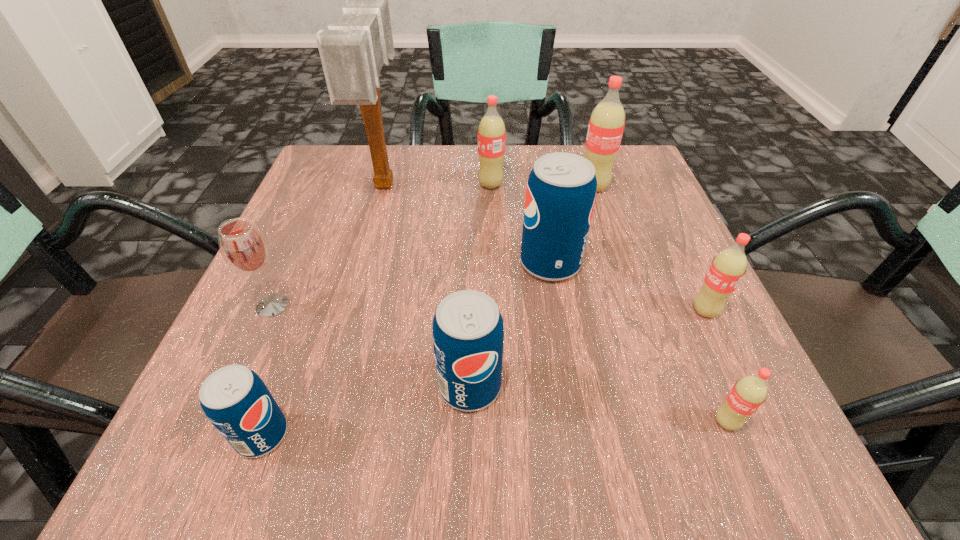
Locate which soda is the closest to the second biggest red soda. Please provide its 2D coordinates. Your answer should be formatted as a tuple, i.e. [(x, y)], where the tuple contains the x and y coordinates of a point satisfying the conditions above.

[(606, 125)]

Choose which red soda is the nearest neighbor to the fourth farthest object. Please provide its 2D coordinates. Your answer should be formatted as a tuple, i.e. [(x, y)], where the tuple contains the x and y coordinates of a point satisfying the conditions above.

[(606, 125)]

The width and height of the screenshot is (960, 540). I want to click on red soda that is the nearest to the second smallest blue pop, so click(x=750, y=392).

Locate which blue pop ranks second in proximity to the biggest blue pop. Please provide its 2D coordinates. Your answer should be formatted as a tuple, i.e. [(x, y)], where the tuple contains the x and y coordinates of a point satisfying the conditions above.

[(235, 400)]

Point out which blue pop is positioned as the third nearest to the seventh object from right to left. Please provide its 2D coordinates. Your answer should be formatted as a tuple, i.e. [(x, y)], where the tuple contains the x and y coordinates of a point satisfying the conditions above.

[(235, 400)]

The image size is (960, 540). I want to click on blank area in the image that satisfies the following two spatial constraints: 1. on the back side of the smallest blue pop; 2. on the left side of the fourth soda from left to right, so click(x=324, y=263).

Where is `blank space that satisfies the following two spatial constraints: 1. on the back side of the third object from left to right; 2. on the left side of the red wineglass`? The width and height of the screenshot is (960, 540). blank space that satisfies the following two spatial constraints: 1. on the back side of the third object from left to right; 2. on the left side of the red wineglass is located at coordinates (326, 184).

Where is `free space that satisfies the following two spatial constraints: 1. on the back side of the third object from right to left; 2. on the left side of the sixth object from left to right`? free space that satisfies the following two spatial constraints: 1. on the back side of the third object from right to left; 2. on the left side of the sixth object from left to right is located at coordinates pyautogui.click(x=538, y=187).

What are the coordinates of `vacant space that satisfies the following two spatial constraints: 1. on the front side of the red wineglass; 2. on the left side of the second nearest red soda` in the screenshot? It's located at (270, 311).